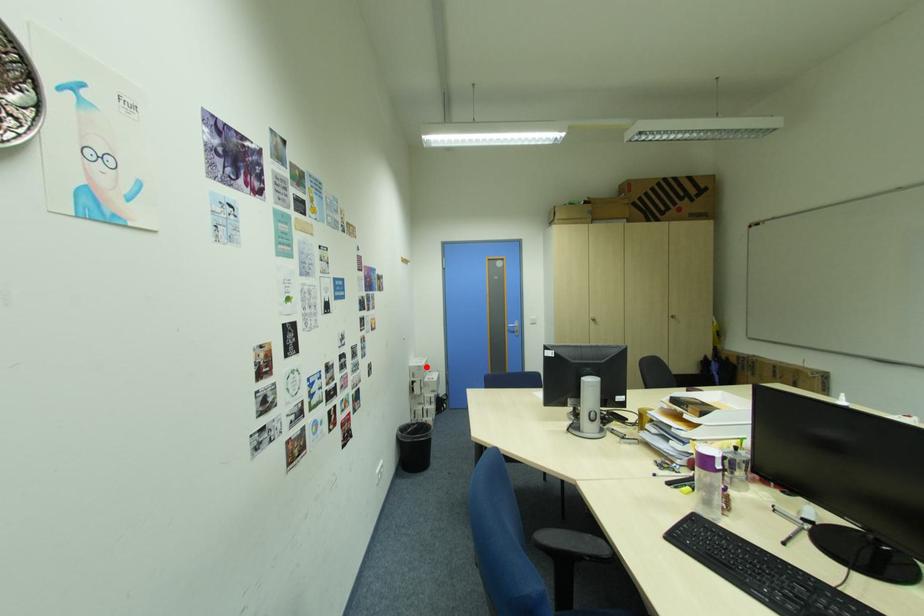
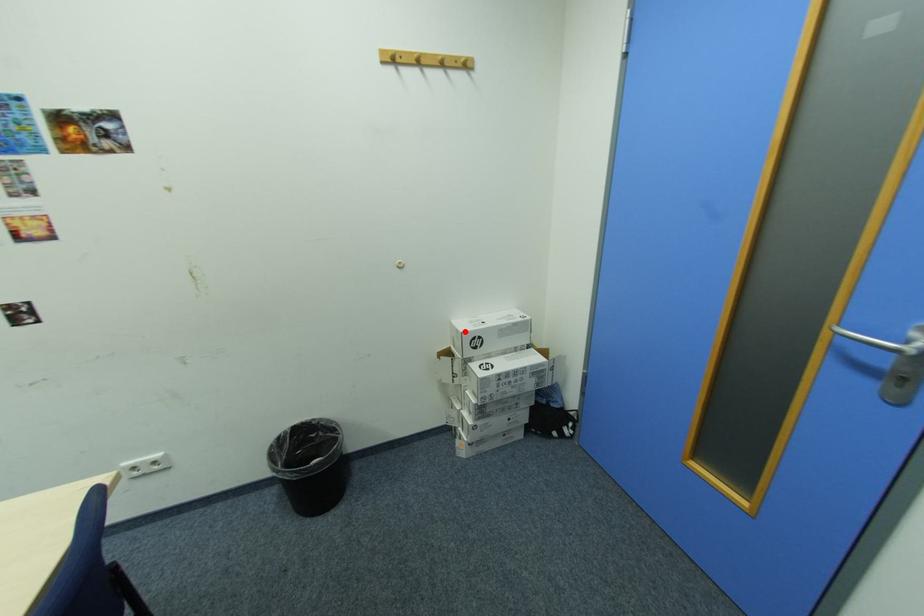
I am providing you with two images of the same scene from different viewpoints. A red point is marked on the first image and another point is marked on the second image. Are the points marked in image1 and image2 representing the same 3D position?

Yes